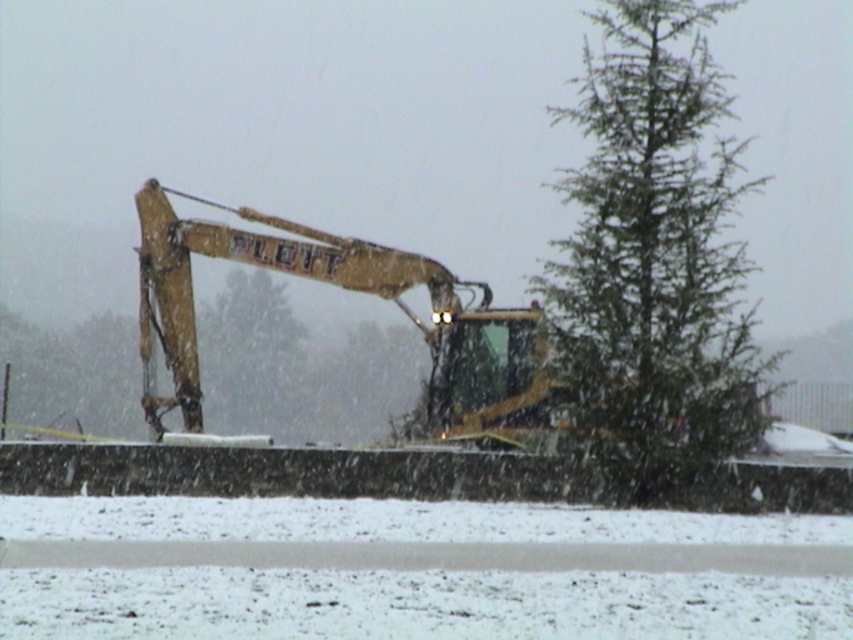
Question: Which point is closer to the camera?

Choices:
 (A) green needle-like tree at right
 (B) yellow metallic excavator at center

Answer: (A)

Question: Does green needle-like tree at right have a lesser width compared to yellow metallic excavator at center?

Choices:
 (A) yes
 (B) no

Answer: (B)

Question: Does green needle-like tree at right lie behind yellow metallic excavator at center?

Choices:
 (A) no
 (B) yes

Answer: (A)

Question: Does green needle-like tree at right appear under yellow metallic excavator at center?

Choices:
 (A) yes
 (B) no

Answer: (B)